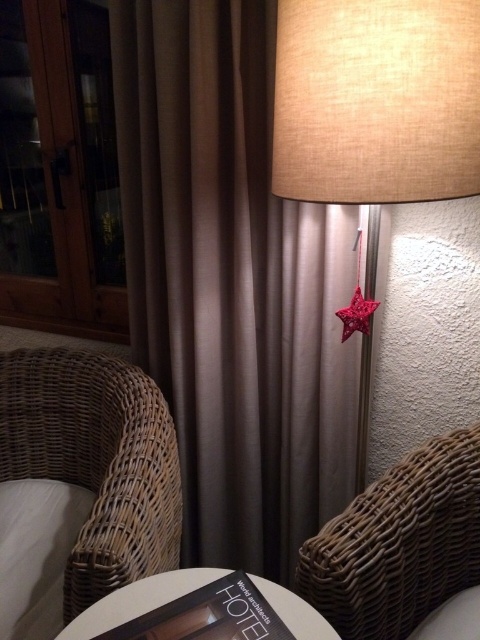
Question: Can you confirm if brown wicker armchair at lower right is positioned above white matte table at center?

Choices:
 (A) yes
 (B) no

Answer: (A)

Question: Which object is positioned closest to the brown wicker armchair at lower right?

Choices:
 (A) white soft pillow at lower left
 (B) beige fabric lampshade at center
 (C) red fabric star at upper right
 (D) woven rattan armchair at lower left

Answer: (C)

Question: Which point is farther from the camera taking this photo?

Choices:
 (A) (354, 316)
 (B) (459, 179)
 (C) (291, 608)

Answer: (A)

Question: Which of the following is the closest to the observer?

Choices:
 (A) (205, 580)
 (B) (33, 464)

Answer: (A)

Question: Is woven rattan armchair at lower left above white matte table at center?

Choices:
 (A) yes
 (B) no

Answer: (A)

Question: From the image, what is the correct spatial relationship of woven rattan armchair at lower left in relation to white soft pillow at lower left?

Choices:
 (A) below
 (B) above

Answer: (B)